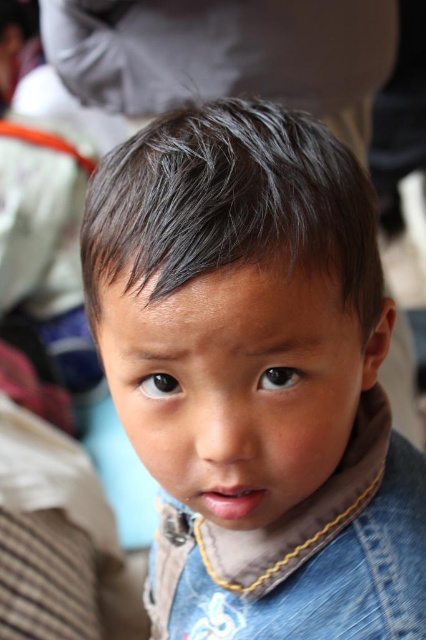
In the scene shown: Based on the scene description, which object is smaller in size between the dark brown hair at center and the denim jacket at lower right?

The dark brown hair at center is smaller in size compared to the denim jacket at lower right according to the description.

You are a photographer trying to focus on the child in the image. Which hair detail should you adjust your focus to capture the brown fuzzy hair at center and dark brown hair at center more clearly?

The brown fuzzy hair at center is in front of the dark brown hair at center, so adjusting focus to the brown fuzzy hair at center will ensure it appears clearer in the photo.

You are a photographer adjusting the focus of your camera. You have two points in the image you need to focus on, point (267, 188) and point (414, 604). Which point is closer to the camera lens?

Point (267, 188) is in front of point (414, 604), so it is closer to the camera lens.